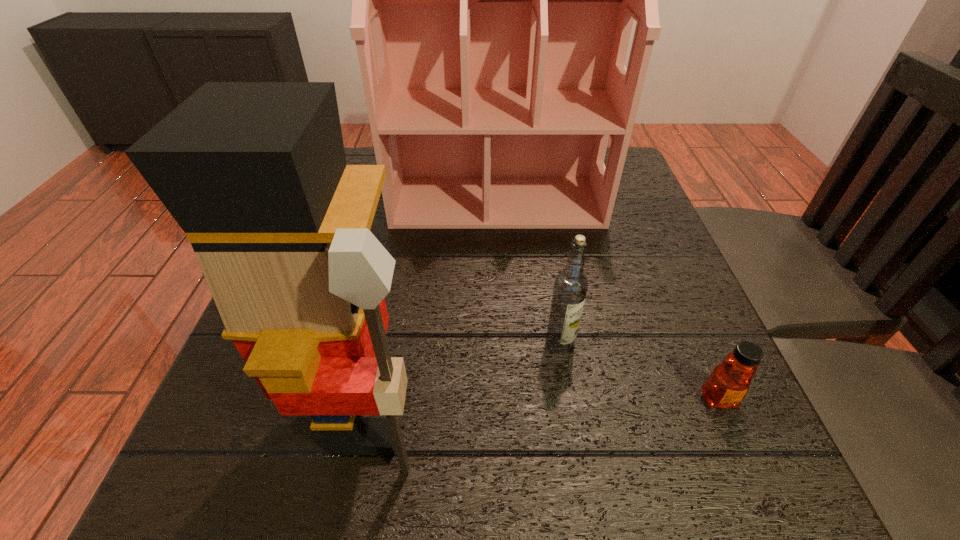
Where is `object that is the second closest to the third tallest object`? This screenshot has width=960, height=540. object that is the second closest to the third tallest object is located at coordinates (727, 385).

Identify which object is the second closest to the rightmost object. Please provide its 2D coordinates. Your answer should be formatted as a tuple, i.e. [(x, y)], where the tuple contains the x and y coordinates of a point satisfying the conditions above.

[(493, 0)]

What are the coordinates of `free space in the image that satisfies the following two spatial constraints: 1. on the front-facing side of the dollhouse; 2. in front of the nutcracker holding the staff` in the screenshot? It's located at (507, 415).

At what (x,y) coordinates should I click in order to perform the action: click on free spot that satisfies the following two spatial constraints: 1. on the front-facing side of the farthest object; 2. in front of the nutcracker holding the staff. Please return your answer as a coordinate pair (x, y). This screenshot has height=540, width=960. Looking at the image, I should click on (507, 415).

This screenshot has height=540, width=960. In order to click on vacant space that satisfies the following two spatial constraints: 1. on the front-facing side of the dollhouse; 2. in front of the nutcracker holding the staff in this screenshot , I will do `click(507, 415)`.

I want to click on blank space that satisfies the following two spatial constraints: 1. on the front-facing side of the dollhouse; 2. in front of the nutcracker holding the staff, so tap(507, 415).

Identify the location of blank space that satisfies the following two spatial constraints: 1. on the label of the second shortest object; 2. in front of the nutcracker holding the staff. The image size is (960, 540). (571, 415).

The width and height of the screenshot is (960, 540). Identify the location of vacant area that satisfies the following two spatial constraints: 1. on the label of the vodka; 2. in front of the nutcracker holding the staff. (571, 415).